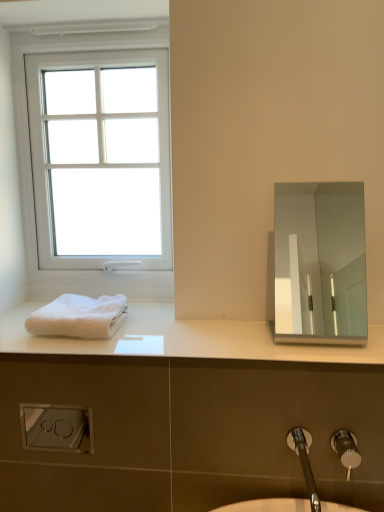
Question: Is polished silver mirror at upper right not near white matte towel at left?

Choices:
 (A) no
 (B) yes

Answer: (B)

Question: Is polished silver mirror at upper right taller than white matte towel at left?

Choices:
 (A) no
 (B) yes

Answer: (B)

Question: From the image's perspective, is polished silver mirror at upper right above white matte towel at left?

Choices:
 (A) no
 (B) yes

Answer: (B)

Question: Is polished silver mirror at upper right not inside white matte towel at left?

Choices:
 (A) no
 (B) yes

Answer: (B)

Question: Can white matte towel at left be found inside polished silver mirror at upper right?

Choices:
 (A) yes
 (B) no

Answer: (B)

Question: Do you think brushed metal faucet at lower right is within white plastic window at upper left, or outside of it?

Choices:
 (A) outside
 (B) inside

Answer: (A)

Question: From a real-world perspective, is brushed metal faucet at lower right above or below white plastic window at upper left?

Choices:
 (A) below
 (B) above

Answer: (A)

Question: Is brushed metal faucet at lower right in front of or behind white plastic window at upper left in the image?

Choices:
 (A) behind
 (B) front

Answer: (B)

Question: Is brushed metal faucet at lower right taller or shorter than white plastic window at upper left?

Choices:
 (A) short
 (B) tall

Answer: (A)

Question: In terms of size, does polished silver mirror at upper right appear bigger or smaller than brushed metal faucet at lower right?

Choices:
 (A) small
 (B) big

Answer: (B)

Question: Relative to brushed metal faucet at lower right, is polished silver mirror at upper right in front or behind?

Choices:
 (A) front
 (B) behind

Answer: (B)

Question: Based on their positions, is polished silver mirror at upper right located to the left or right of brushed metal faucet at lower right?

Choices:
 (A) left
 (B) right

Answer: (A)

Question: From a real-world perspective, is polished silver mirror at upper right above or below brushed metal faucet at lower right?

Choices:
 (A) above
 (B) below

Answer: (A)

Question: Is white plastic window at upper left bigger or smaller than white fluffy towel at lower left?

Choices:
 (A) big
 (B) small

Answer: (A)

Question: Is point (41, 41) closer or farther from the camera than point (89, 310)?

Choices:
 (A) closer
 (B) farther

Answer: (B)